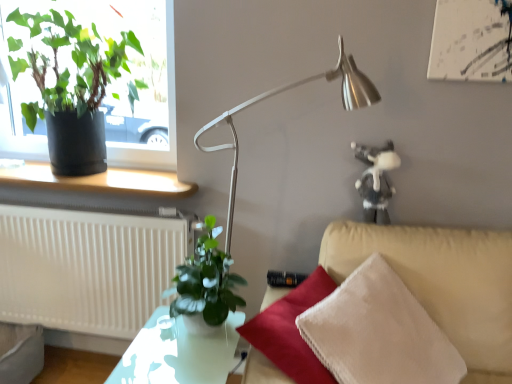
You are a GUI agent. You are given a task and a screenshot of the screen. Output one action in this format:
    pyautogui.click(x=<x>, y=<y>)
    Task: Click on the blank space situated above translucent glass table at center (from a real-world perspective)
    This screenshot has width=512, height=384.
    Given the screenshot: What is the action you would take?
    pyautogui.click(x=181, y=346)